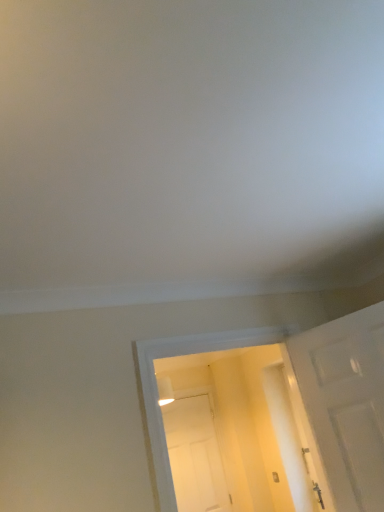
Question: From a real-world perspective, is white matte door at center, which appears as the second door when viewed from the top, positioned under white matte door at right, which ranks as the first door in top-to-bottom order, based on gravity?

Choices:
 (A) yes
 (B) no

Answer: (A)

Question: Can we say white matte door at center, the first door ordered from the bottom, lies outside white matte door at right, the second door positioned from the back?

Choices:
 (A) yes
 (B) no

Answer: (A)

Question: Considering the relative sizes of white matte door at center, marked as the first door in a left-to-right arrangement, and white matte door at right, which ranks as the first door in top-to-bottom order, in the image provided, is white matte door at center, marked as the first door in a left-to-right arrangement, thinner than white matte door at right, which ranks as the first door in top-to-bottom order,?

Choices:
 (A) no
 (B) yes

Answer: (A)

Question: Is white matte door at right, the second door positioned from the back, completely or partially inside white matte door at center, which appears as the second door when viewed from the right?

Choices:
 (A) no
 (B) yes

Answer: (A)

Question: Can you confirm if white matte door at center, the second door when ordered from front to back, is wider than white matte door at right, arranged as the second door when ordered from the bottom?

Choices:
 (A) yes
 (B) no

Answer: (A)

Question: Is white matte door at center, the second door when ordered from front to back, directly adjacent to white matte door at right, the second door positioned from the back?

Choices:
 (A) no
 (B) yes

Answer: (A)

Question: Does white matte door at right, arranged as the 2th door when viewed from the left, have a greater width compared to white matte door at center, the second door when ordered from front to back?

Choices:
 (A) no
 (B) yes

Answer: (A)

Question: Is white matte door at right, arranged as the second door when ordered from the bottom, located outside white matte door at center, which is the first door from back to front?

Choices:
 (A) no
 (B) yes

Answer: (B)

Question: Is the depth of white matte door at right, arranged as the second door when ordered from the bottom, less than that of white matte door at center, which is the first door from back to front?

Choices:
 (A) no
 (B) yes

Answer: (B)

Question: Could you tell me if white matte door at right, which ranks as the first door in top-to-bottom order, is facing white matte door at center, which is the first door from back to front?

Choices:
 (A) no
 (B) yes

Answer: (A)

Question: Can you confirm if white matte door at right, arranged as the second door when ordered from the bottom, is thinner than white matte door at center, which appears as the second door when viewed from the top?

Choices:
 (A) no
 (B) yes

Answer: (B)

Question: Considering the relative sizes of white matte door at right, which appears as the first door when viewed from the right, and white matte door at center, marked as the first door in a left-to-right arrangement, in the image provided, is white matte door at right, which appears as the first door when viewed from the right, shorter than white matte door at center, marked as the first door in a left-to-right arrangement,?

Choices:
 (A) yes
 (B) no

Answer: (A)

Question: Is white matte door at right, acting as the 1th door starting from the front, spatially inside white matte door at center, which is the first door from back to front, or outside of it?

Choices:
 (A) outside
 (B) inside

Answer: (A)